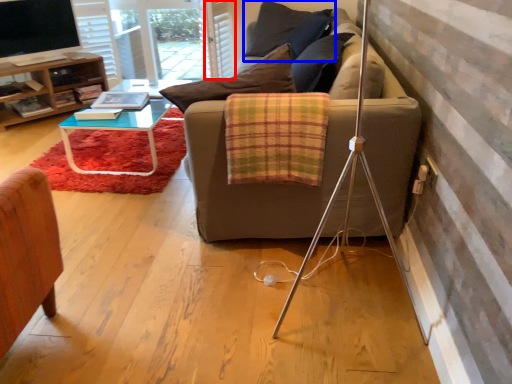
Question: Which object appears closest to the camera in this image, curtain (highlighted by a red box) or pillow (highlighted by a blue box)?

Choices:
 (A) curtain
 (B) pillow

Answer: (B)